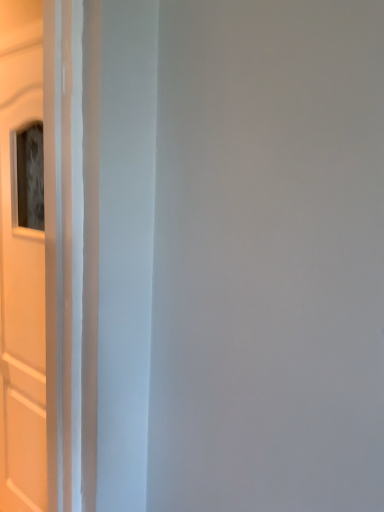
Question: Should I look upward or downward to see white matte door at left?

Choices:
 (A) down
 (B) up

Answer: (A)